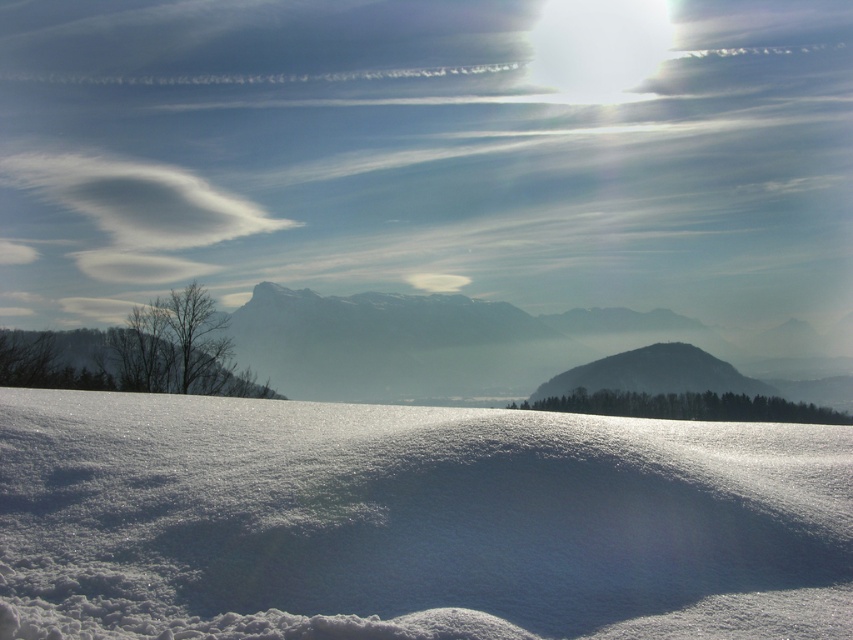
You are an observer looking at the winter landscape. You notice the white fluffy snow at center and the smooth gray rock at center. Which object is positioned higher in the scene?

The white fluffy snow at center is located above the smooth gray rock at center, so it is positioned higher in the scene.